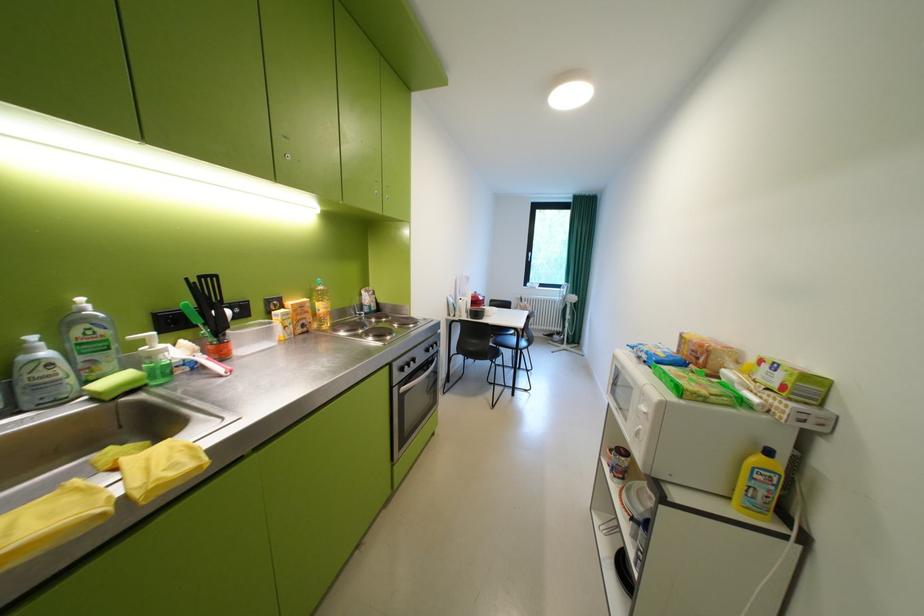
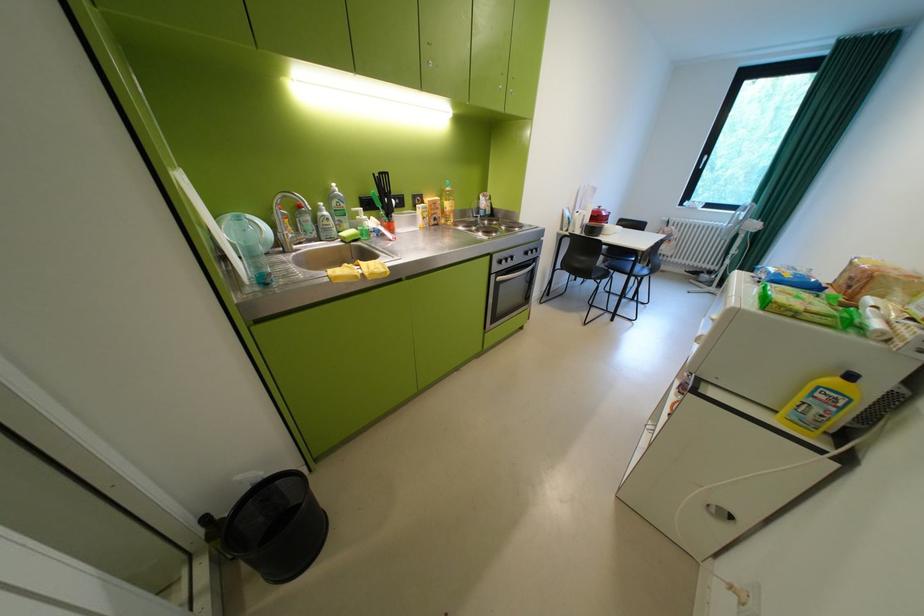
The point at (819, 472) is marked in the first image. Where is the corresponding point in the second image?

(918, 411)